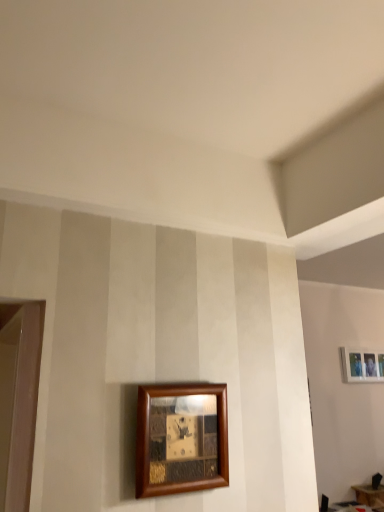
Question: In terms of size, does wooden picture frame at lower center, the first picture frame from the left, appear bigger or smaller than wooden table at lower right?

Choices:
 (A) big
 (B) small

Answer: (B)

Question: Considering the positions of wooden picture frame at lower center, the first picture frame from the front, and wooden table at lower right in the image, is wooden picture frame at lower center, the first picture frame from the front, taller or shorter than wooden table at lower right?

Choices:
 (A) tall
 (B) short

Answer: (A)

Question: Based on their relative distances, which object is farther from the wooden table at lower right?

Choices:
 (A) wooden picture frame at lower center, which is the second picture frame in bottom-to-top order
 (B) white matte picture frame at upper right, placed as the first picture frame when sorted from back to front

Answer: (A)

Question: Which is nearer to the white matte picture frame at upper right, placed as the first picture frame when sorted from back to front?

Choices:
 (A) wooden table at lower right
 (B) wooden picture frame at lower center, the first picture frame from the front

Answer: (A)